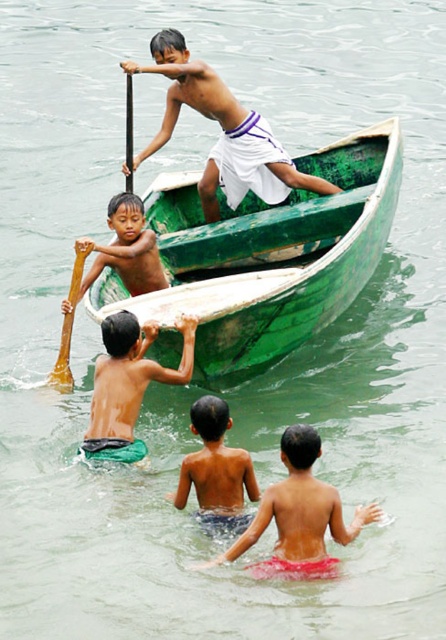
Locate an element on the screen. The height and width of the screenshot is (640, 446). green matte boat at center is located at coordinates (x=267, y=257).

Measure the distance from green matte boat at center to light brown wooden paddle at upper left.

green matte boat at center is 6.00 meters away from light brown wooden paddle at upper left.

Is point (257, 256) in front of point (145, 237)?

No, it is behind (145, 237).

The width and height of the screenshot is (446, 640). I want to click on green matte boat at center, so click(x=267, y=257).

Is green fabric shorts at lower left behind light brown wooden paddle at upper left?

No, green fabric shorts at lower left is in front of light brown wooden paddle at upper left.

The height and width of the screenshot is (640, 446). What do you see at coordinates (128, 385) in the screenshot?
I see `green fabric shorts at lower left` at bounding box center [128, 385].

Is point (116, 324) closer to viewer compared to point (133, 228)?

Yes, point (116, 324) is closer to viewer.

Identify the location of green fabric shorts at lower left. (128, 385).

Can you confirm if matte white shorts at upper center is smaller than green fabric shorts at lower left?

Incorrect, matte white shorts at upper center is not smaller in size than green fabric shorts at lower left.

Which of these two, matte white shorts at upper center or green fabric shorts at lower left, stands taller?

matte white shorts at upper center is taller.

Does point (202, 65) come behind point (102, 323)?

Yes, point (202, 65) is farther from viewer.

In order to click on matte white shorts at upper center in this screenshot , I will do `click(222, 132)`.